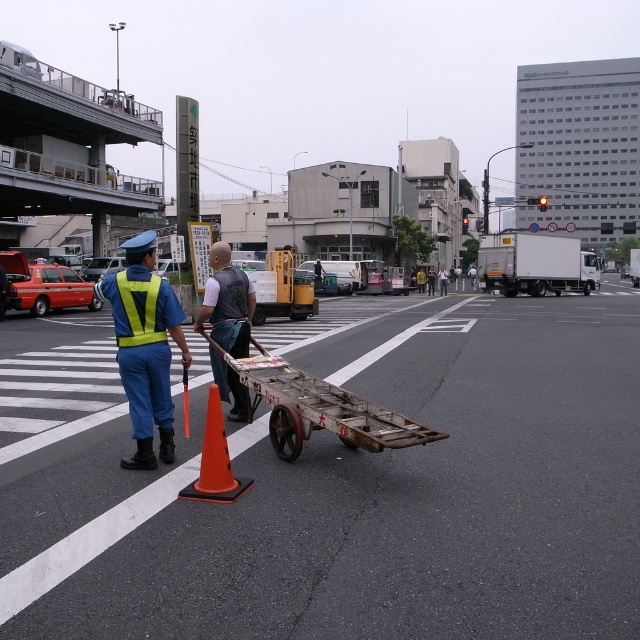
Which is behind, point (321, 385) or point (212, 456)?

The point (321, 385) is more distant.

Is rusty metal cart at center shorter than orange matte traffic cone at lower center?

No.

Which is behind, point (364, 432) or point (227, 456)?

Positioned behind is point (364, 432).

I want to click on rusty metal cart at center, so click(x=317, y=406).

What do you see at coordinates (214, 460) in the screenshot?
I see `orange matte traffic cone at lower center` at bounding box center [214, 460].

Does orange matte traffic cone at lower center appear over high-visibility fabric safety vest at left?

No.

This screenshot has height=640, width=640. What do you see at coordinates (214, 460) in the screenshot?
I see `orange matte traffic cone at lower center` at bounding box center [214, 460].

The width and height of the screenshot is (640, 640). Find the location of `orange matte traffic cone at lower center`. orange matte traffic cone at lower center is located at coordinates (214, 460).

Between point (163, 372) and point (131, 344), which one is positioned in front?

Point (131, 344)

Who is more distant from viewer, (x=166, y=394) or (x=134, y=310)?

Point (x=166, y=394)

Does point (131, 348) come in front of point (122, 288)?

No, it is behind (122, 288).

Locate an element on the screen. reflective yellow vest at center is located at coordinates (145, 348).